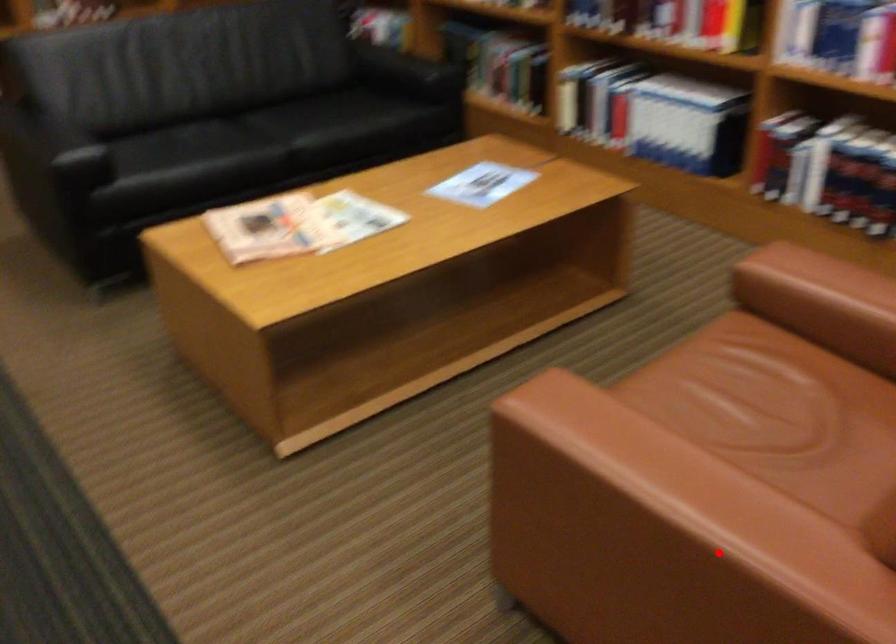
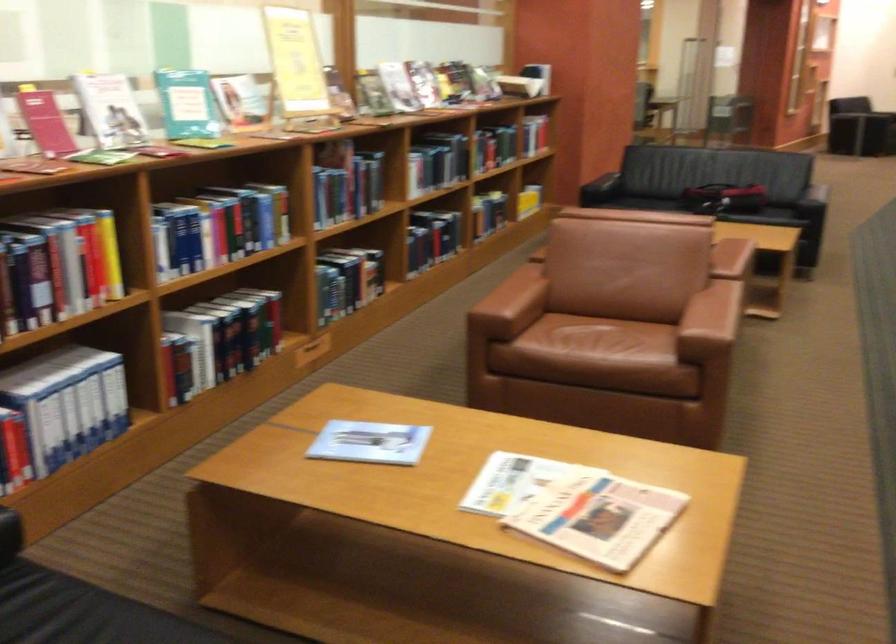
Question: I am providing you with two images of the same scene from different viewpoints. Given a red point in image1, look at the same physical point in image2. Is it:

Choices:
 (A) Closer to the viewpoint
 (B) Farther from the viewpoint

Answer: (B)